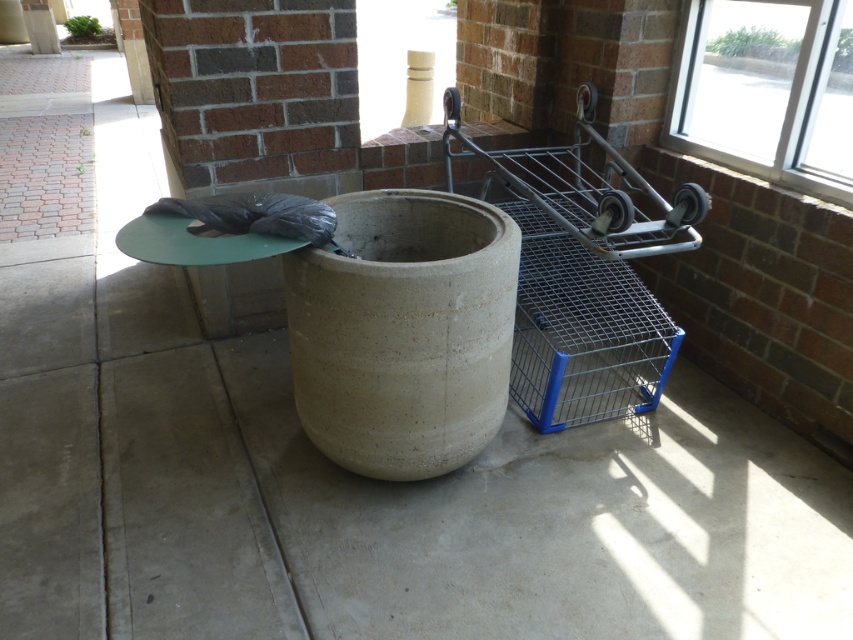
Can you confirm if metallic wire cart at right is shorter than transparent glass window at upper right?

Incorrect, metallic wire cart at right's height does not fall short of transparent glass window at upper right's.

Can you confirm if metallic wire cart at right is positioned below transparent glass window at upper right?

Yes, metallic wire cart at right is below transparent glass window at upper right.

Which is behind, point (572, 148) or point (711, 77)?

The point (572, 148) is more distant.

Locate an element on the screen. metallic wire cart at right is located at coordinates (583, 275).

Does point (471, 298) lie in front of point (567, 186)?

Yes, point (471, 298) is closer to viewer.

Between beige concrete barrel at center and metallic wire cart at right, which one is positioned lower?

beige concrete barrel at center is lower down.

Which is behind, point (372, 308) or point (523, 394)?

The point (523, 394) is behind.

You are a GUI agent. You are given a task and a screenshot of the screen. Output one action in this format:
    pyautogui.click(x=<x>, y=<y>)
    Task: Click on the beige concrete barrel at center
    This screenshot has width=853, height=640.
    Given the screenshot: What is the action you would take?
    pyautogui.click(x=403, y=332)

Which is more to the left, beige concrete barrel at center or transparent glass window at upper right?

Positioned to the left is beige concrete barrel at center.

Who is more distant from viewer, (x=389, y=444) or (x=757, y=163)?

The point (x=757, y=163) is behind.

This screenshot has height=640, width=853. Find the location of `beige concrete barrel at center`. beige concrete barrel at center is located at coordinates (403, 332).